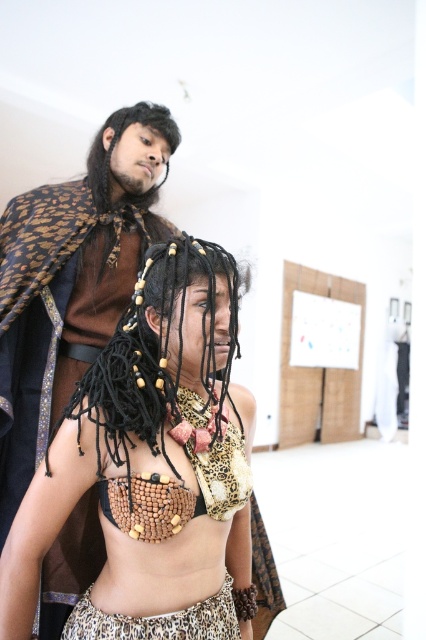
You are standing in the room and see two points marked in the image. Which point, point (152, 509) or point (164, 326), is closer to you?

Point (152, 509) is closer to the viewer than point (164, 326).

You are a jeweler examining two beaded items in the image. The wooden beads necklace at center and the black beaded hair at center. Which item has beads that are wider?

The wooden beads necklace at center might be wider than black beaded hair at center according to the description.